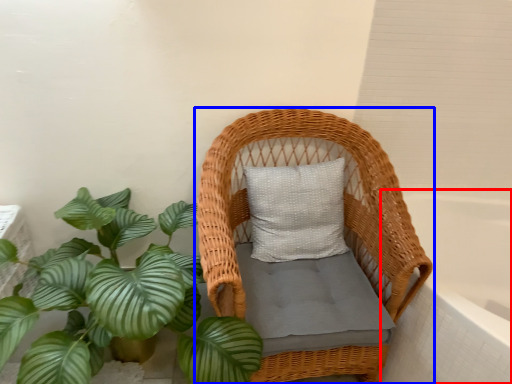
Question: Which object is further to the camera taking this photo, bath (highlighted by a red box) or furniture (highlighted by a blue box)?

Choices:
 (A) bath
 (B) furniture

Answer: (A)